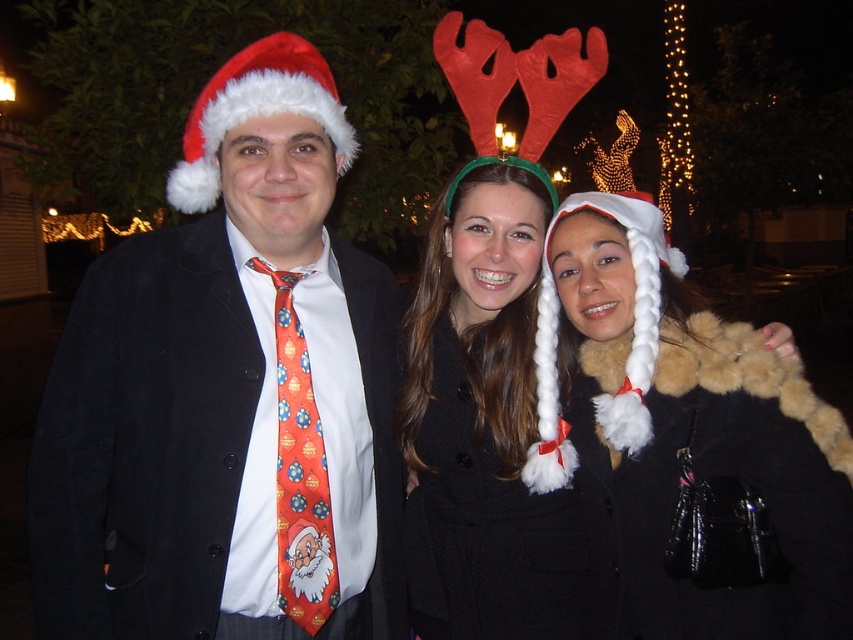
You are standing in a festive outdoor setting at night. You see a fuzzy black coat at center. Can you walk up to it without moving closer than 2 meters to it?

The distance between the fuzzy black coat at center and the viewer is 2.31 meters. Since 2.31 meters is more than 2 meters, you can walk up to it while maintaining the required distance.

You are organizing a coat check at a holiday party and need to store the matte black coat at center and the fuzzy black coat at center. Given their sizes, which coat should you place in the larger designated storage space?

The matte black coat at center is larger in size than the fuzzy black coat at center, so the matte black coat at center should be placed in the larger designated storage space.

You are standing at the origin point in the image. Which direction should you move to reach the fuzzy black coat at center?

The fuzzy black coat at center is located at coordinates approximately 0.697 on the x and 0.803 on the y axis. Since you are at the origin, you should move towards the positive x and positive y directions to reach it.